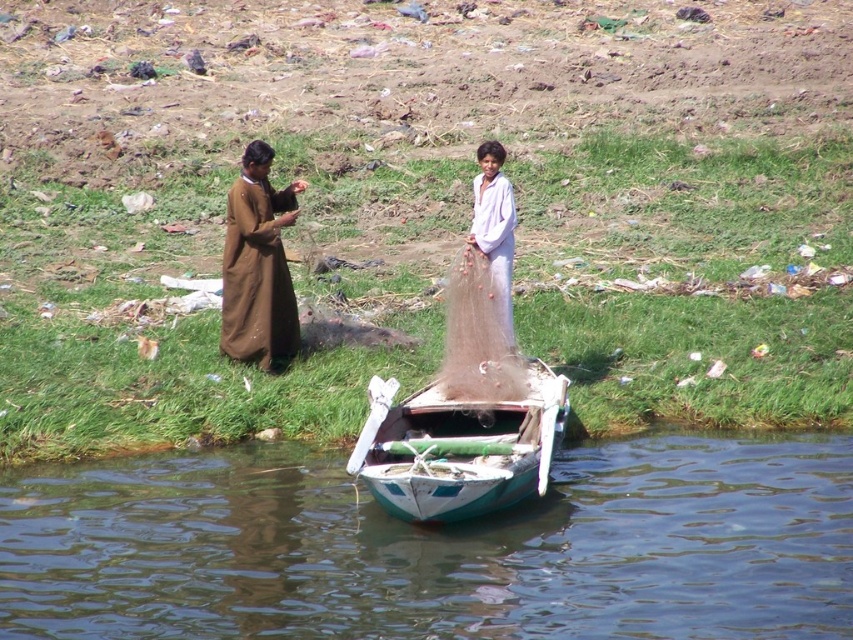
Who is higher up, smooth green water at lower center or white matte net at center?

Positioned higher is white matte net at center.

Is smooth green water at lower center to the right of white matte net at center from the viewer's perspective?

Incorrect, smooth green water at lower center is not on the right side of white matte net at center.

You are a GUI agent. You are given a task and a screenshot of the screen. Output one action in this format:
    pyautogui.click(x=<x>, y=<y>)
    Task: Click on the smooth green water at lower center
    This screenshot has width=853, height=640.
    Given the screenshot: What is the action you would take?
    pyautogui.click(x=437, y=547)

Can you confirm if teal wooden boat at center is positioned to the left of white matte net at center?

Yes, teal wooden boat at center is to the left of white matte net at center.

Is point (492, 486) positioned behind point (486, 237)?

That is False.

I want to click on teal wooden boat at center, so click(x=459, y=448).

Which of these two, smooth green water at lower center or brown matte robe at upper left, stands taller?

Standing taller between the two is brown matte robe at upper left.

Measure the distance between smooth green water at lower center and brown matte robe at upper left.

smooth green water at lower center is 5.13 meters away from brown matte robe at upper left.

Between point (515, 625) and point (268, 192), which one is positioned behind?

Point (268, 192)

Find the location of a particular element. smooth green water at lower center is located at coordinates (437, 547).